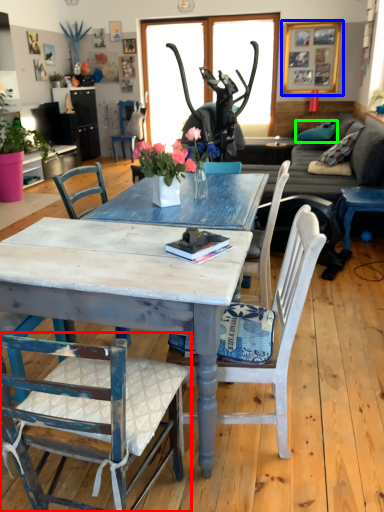
Question: Considering the real-world distances, which object is closest to chair (highlighted by a red box)? picture frame (highlighted by a blue box) or pillow (highlighted by a green box).

Choices:
 (A) picture frame
 (B) pillow

Answer: (B)